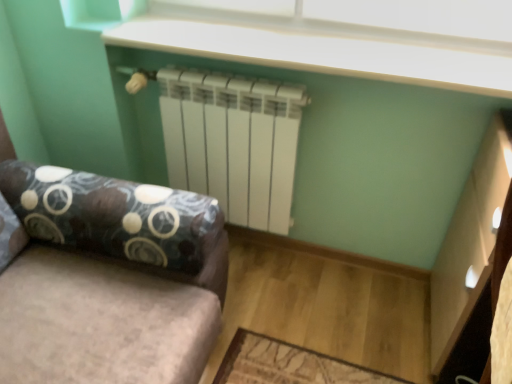
This screenshot has width=512, height=384. Describe the element at coordinates (233, 142) in the screenshot. I see `white matte radiator at center` at that location.

What is the approximate height of white plastic window screen at upper center?

white plastic window screen at upper center is 6.02 inches tall.

Find the location of a particular element. This screenshot has height=384, width=512. velvet fabric studio couch at center is located at coordinates (109, 280).

Considering the sizes of objects white plastic window screen at upper center and white matte radiator at center in the image provided, who is bigger, white plastic window screen at upper center or white matte radiator at center?

Bigger between the two is white matte radiator at center.

Which object is positioned more to the left, white plastic window screen at upper center or white matte radiator at center?

white matte radiator at center is more to the left.

From a real-world perspective, is white plastic window screen at upper center above or below white matte radiator at center?

In terms of real-world spatial position, white plastic window screen at upper center is above white matte radiator at center.

Does white plastic window screen at upper center turn towards white matte radiator at center?

No, white plastic window screen at upper center is not turned towards white matte radiator at center.

From the image's perspective, is velvet fabric studio couch at center above or below white matte radiator at center?

Clearly, from the image's perspective, velvet fabric studio couch at center is below white matte radiator at center.

Locate an element on the screen. studio couch below the white matte radiator at center (from a real-world perspective) is located at coordinates (109, 280).

Considering the positions of objects velvet fabric studio couch at center and white matte radiator at center in the image provided, who is more to the right, velvet fabric studio couch at center or white matte radiator at center?

From the viewer's perspective, white matte radiator at center appears more on the right side.

Is velvet fabric studio couch at center inside or outside of white matte radiator at center?

velvet fabric studio couch at center lies outside white matte radiator at center.

Identify the location of studio couch in front of the white plastic window screen at upper center. Image resolution: width=512 pixels, height=384 pixels. (109, 280).

Which is more to the left, white plastic window screen at upper center or velvet fabric studio couch at center?

Positioned to the left is velvet fabric studio couch at center.

Can you tell me how much white plastic window screen at upper center and velvet fabric studio couch at center differ in facing direction?

The facing directions of white plastic window screen at upper center and velvet fabric studio couch at center are 90.5 degrees apart.

How different are the orientations of white matte radiator at center and white plastic window screen at upper center in degrees?

The angular difference between white matte radiator at center and white plastic window screen at upper center is 0.279 degrees.

Is the position of white matte radiator at center more distant than that of white plastic window screen at upper center?

Yes, white matte radiator at center is behind white plastic window screen at upper center.

From the image's perspective, which object appears higher, white matte radiator at center or white plastic window screen at upper center?

From the image's view, white plastic window screen at upper center is above.

Is white matte radiator at center not near white plastic window screen at upper center?

That's not correct — white matte radiator at center is a little close to white plastic window screen at upper center.

Considering the points (5, 324) and (257, 5), which point is in front, point (5, 324) or point (257, 5)?

The point (5, 324) is closer to the camera.

Consider the image. Is velvet fabric studio couch at center bigger or smaller than white plastic window screen at upper center?

Considering their sizes, velvet fabric studio couch at center takes up more space than white plastic window screen at upper center.

Considering their positions, is velvet fabric studio couch at center located in front of or behind white plastic window screen at upper center?

velvet fabric studio couch at center is in front of white plastic window screen at upper center.

The image size is (512, 384). In order to click on studio couch that appears in front of the white plastic window screen at upper center in this screenshot , I will do pos(109,280).

From the image's perspective, is white matte radiator at center under velvet fabric studio couch at center?

Incorrect, from the image's perspective, white matte radiator at center is higher than velvet fabric studio couch at center.

Could you tell me if white matte radiator at center is turned towards velvet fabric studio couch at center?

Yes, white matte radiator at center is facing velvet fabric studio couch at center.

In terms of width, does white matte radiator at center look wider or thinner when compared to velvet fabric studio couch at center?

In the image, white matte radiator at center appears to be more narrow than velvet fabric studio couch at center.

Identify the location of radiator behind the white plastic window screen at upper center. Image resolution: width=512 pixels, height=384 pixels. (233, 142).

Where is `radiator that appears above the velvet fabric studio couch at center (from the image's perspective)`? radiator that appears above the velvet fabric studio couch at center (from the image's perspective) is located at coordinates (233, 142).

When comparing their distances from white matte radiator at center, does white plastic window screen at upper center or velvet fabric studio couch at center seem further?

velvet fabric studio couch at center.

Estimate the real-world distances between objects in this image. Which object is further from white plastic window screen at upper center, velvet fabric studio couch at center or white matte radiator at center?

velvet fabric studio couch at center is positioned further to the anchor white plastic window screen at upper center.

When comparing their distances from white matte radiator at center, does velvet fabric studio couch at center or white plastic window screen at upper center seem closer?

white plastic window screen at upper center lies closer to white matte radiator at center than the other object.

Considering their positions, is white plastic window screen at upper center positioned further to velvet fabric studio couch at center than white matte radiator at center?

Based on the image, white plastic window screen at upper center appears to be further to velvet fabric studio couch at center.

Based on their spatial positions, is white matte radiator at center or velvet fabric studio couch at center closer to white plastic window screen at upper center?

white matte radiator at center is closer to white plastic window screen at upper center.

Looking at the image, which one is located further to velvet fabric studio couch at center, white matte radiator at center or white plastic window screen at upper center?

white plastic window screen at upper center is positioned further to the anchor velvet fabric studio couch at center.

At what (x,y) coordinates should I click in order to perform the action: click on radiator between white plastic window screen at upper center and velvet fabric studio couch at center in the vertical direction. Please return your answer as a coordinate pair (x, y). Image resolution: width=512 pixels, height=384 pixels. Looking at the image, I should click on (233, 142).